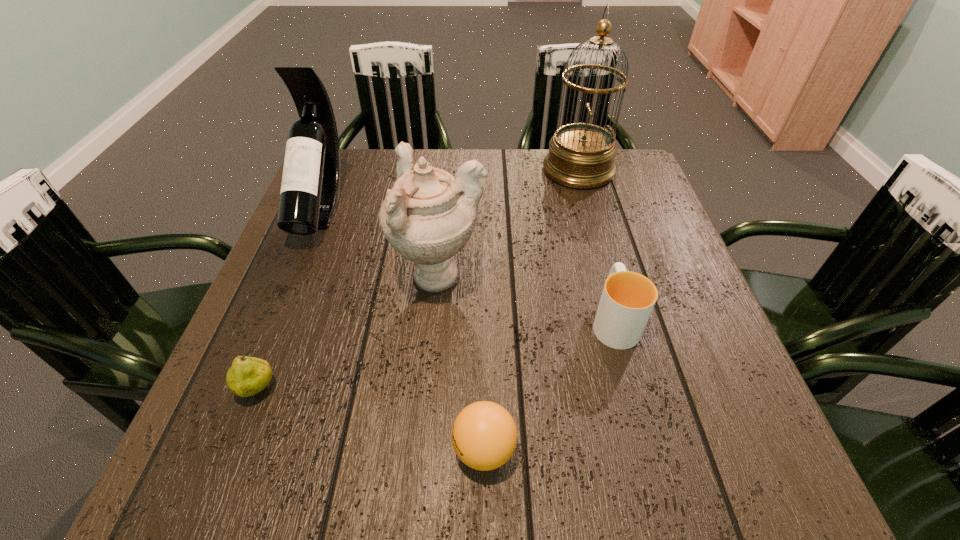
At what (x,y) coordinates should I click in order to perform the action: click on vacant area situated 0.140m on the left of the urn. Please return your answer as a coordinate pair (x, y). Image resolution: width=960 pixels, height=540 pixels. Looking at the image, I should click on (326, 278).

Identify the location of free space located with the handle on the side of the cup. point(590,231).

The image size is (960, 540). In order to click on free location located with the handle on the side of the cup in this screenshot , I will do `click(588, 220)`.

I want to click on vacant area situated 0.400m with the handle on the side of the cup, so click(577, 183).

In order to click on vacant area situated on the right of the pear in this screenshot , I will do `click(360, 389)`.

The height and width of the screenshot is (540, 960). Find the location of `free space located on the side with brand of the nearest object`. free space located on the side with brand of the nearest object is located at coordinates (260, 449).

At what (x,y) coordinates should I click in order to perform the action: click on free space located on the side with brand of the nearest object. Please return your answer as a coordinate pair (x, y). The height and width of the screenshot is (540, 960). Looking at the image, I should click on (401, 449).

You are a GUI agent. You are given a task and a screenshot of the screen. Output one action in this format:
    pyautogui.click(x=<x>, y=<y>)
    Task: Click on the free location located on the side with brand of the nearest object
    The height and width of the screenshot is (540, 960).
    Given the screenshot: What is the action you would take?
    pyautogui.click(x=247, y=449)

This screenshot has height=540, width=960. I want to click on birdcage present at the far edge, so click(x=581, y=155).

Find the location of a particular element. This screenshot has height=540, width=960. wine bottle present at the far edge is located at coordinates (310, 187).